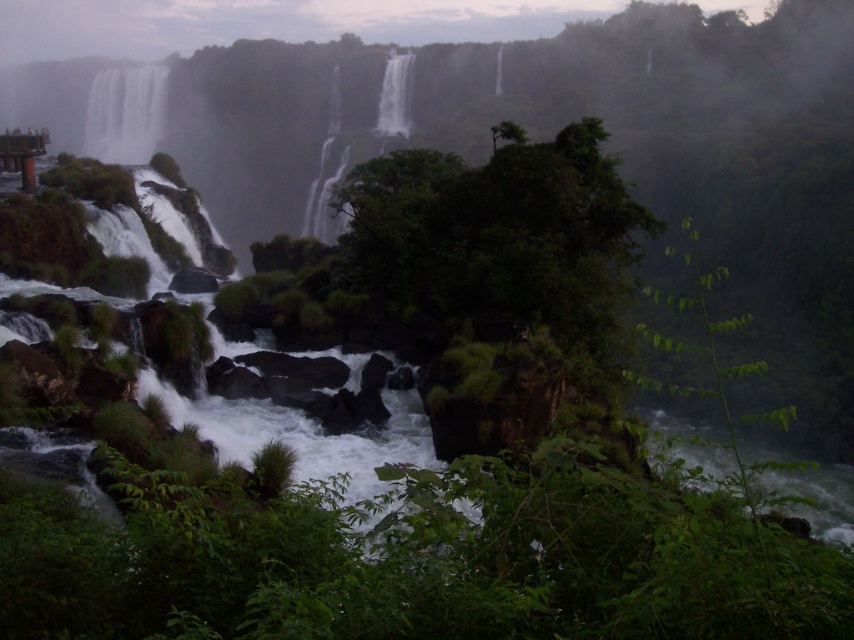
You are standing at the base of the waterfall and want to reach a hidden cave entrance. The entrance is located at point A, which is at coordinate point A is at point [133,74]. There is a slippery rock at point B, which is at point [340,113]. Which point is closer to you, point A or point B?

Point A is closer to you because it is further to the viewer than point B, meaning it is physically nearer in the scene.

You are a photographer planning to capture the white misty waterfall at center and the white frothy water at center in a single shot. Based on their sizes, which one should you focus on to ensure both are visible without cropping?

The white misty waterfall at center is larger in size than the white frothy water at center, so focusing on the white misty waterfall at center will ensure both are visible without cropping.

You are a hiker planning to cross from the white misty waterfall at left to the white frothy water at center. Given that your average walking pace is 1.5 meters per second, how long would it take you to walk directly between them?

The distance between the white misty waterfall at left and the white frothy water at center is 57.56 meters. At a walking pace of 1.5 meters per second, it would take approximately 38.37 seconds to cross the distance.